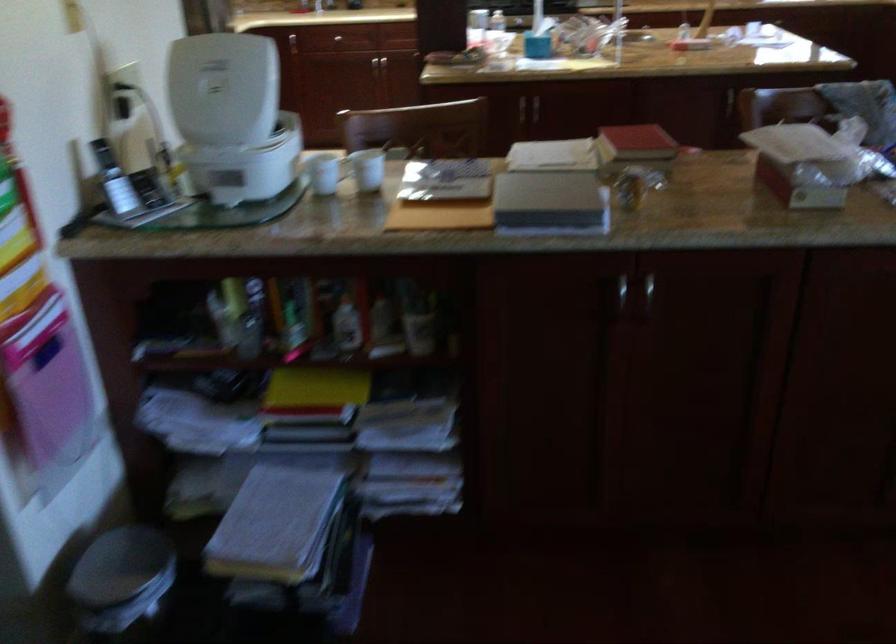
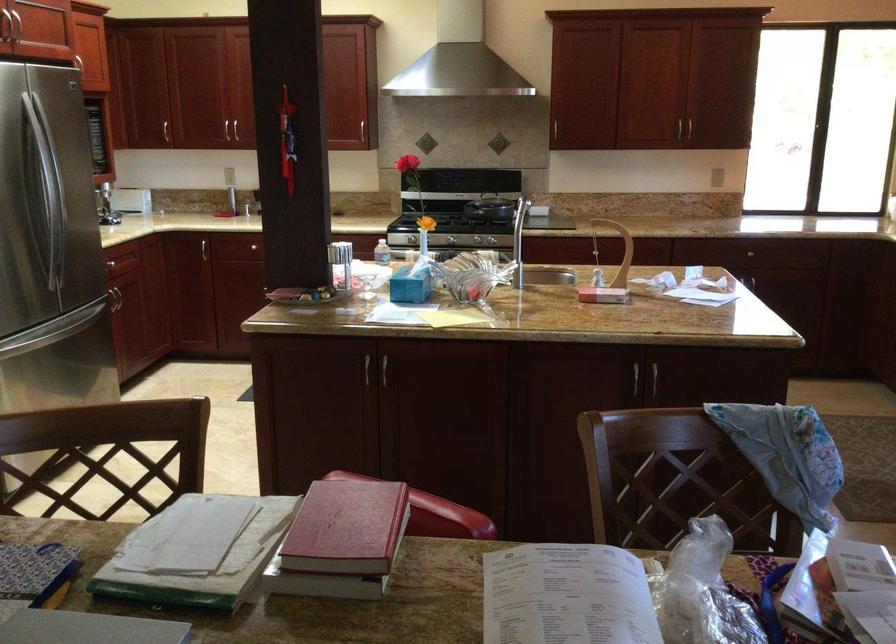
Find the pixel in the second image that matches pixel 656 144 in the first image.

(346, 527)